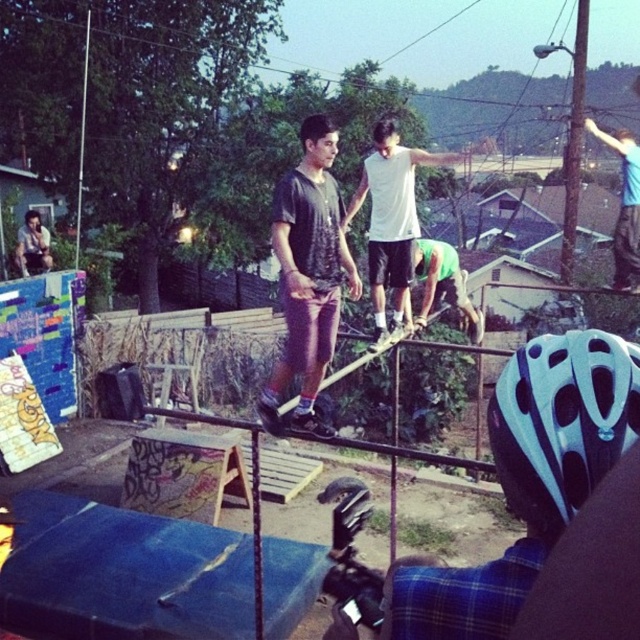
Which is below, blue matte bicycle helmet at center-right or matte black shirt at center?

blue matte bicycle helmet at center-right is below.

Who is more distant from viewer, (x=563, y=520) or (x=324, y=221)?

Positioned behind is point (x=324, y=221).

Image resolution: width=640 pixels, height=640 pixels. I want to click on blue matte bicycle helmet at center-right, so click(561, 420).

Is matte black shirt at center to the right of green matte shirt at center from the viewer's perspective?

Incorrect, matte black shirt at center is not on the right side of green matte shirt at center.

Is matte black shirt at center closer to the viewer compared to green matte shirt at center?

Yes.

Where is `matte black shirt at center`? The image size is (640, 640). matte black shirt at center is located at coordinates (308, 273).

Find the location of `matte black shirt at center`. matte black shirt at center is located at coordinates (308, 273).

Between white matte shirt at center and green matte shirt at center, which one is positioned lower?

Positioned lower is green matte shirt at center.

Can you confirm if white matte shirt at center is positioned above green matte shirt at center?

Yes, white matte shirt at center is above green matte shirt at center.

What do you see at coordinates (392, 218) in the screenshot? The image size is (640, 640). I see `white matte shirt at center` at bounding box center [392, 218].

Locate an element on the screen. This screenshot has width=640, height=640. white matte shirt at center is located at coordinates (392, 218).